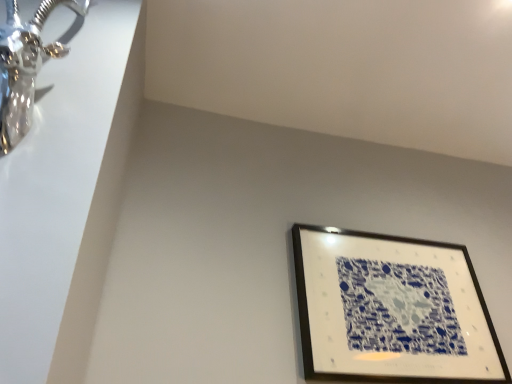
This screenshot has width=512, height=384. Find the location of `matte black picture frame at lower right`. matte black picture frame at lower right is located at coordinates (391, 310).

This screenshot has width=512, height=384. What do you see at coordinates (391, 310) in the screenshot?
I see `matte black picture frame at lower right` at bounding box center [391, 310].

Measure the distance between matte black picture frame at lower right and camera.

matte black picture frame at lower right and camera are 1.26 meters apart.

I want to click on matte black picture frame at lower right, so click(x=391, y=310).